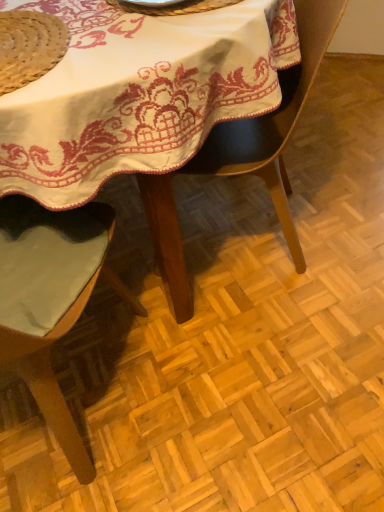
Question: Is green fabric chair at left, which is the second chair in right-to-left order, oriented away from black leather chair at center, the second chair in the left-to-right sequence?

Choices:
 (A) yes
 (B) no

Answer: (B)

Question: Is green fabric chair at left, which is the second chair in right-to-left order, at the right side of black leather chair at center, the first chair viewed from the right?

Choices:
 (A) yes
 (B) no

Answer: (B)

Question: Considering the relative sizes of green fabric chair at left, which appears as the 1th chair when viewed from the left, and black leather chair at center, the second chair in the left-to-right sequence, in the image provided, is green fabric chair at left, which appears as the 1th chair when viewed from the left, bigger than black leather chair at center, the second chair in the left-to-right sequence,?

Choices:
 (A) no
 (B) yes

Answer: (B)

Question: From a real-world perspective, is green fabric chair at left, which is the second chair in right-to-left order, positioned under black leather chair at center, the second chair in the left-to-right sequence, based on gravity?

Choices:
 (A) no
 (B) yes

Answer: (B)

Question: Is green fabric chair at left, which is the second chair in right-to-left order, wider than black leather chair at center, the second chair in the left-to-right sequence?

Choices:
 (A) no
 (B) yes

Answer: (B)

Question: Is natural straw hat at upper left inside the boundaries of green fabric chair at left, which is the second chair in right-to-left order, or outside?

Choices:
 (A) inside
 (B) outside

Answer: (A)

Question: Considering the positions of natural straw hat at upper left and green fabric chair at left, which is the second chair in right-to-left order, in the image, is natural straw hat at upper left wider or thinner than green fabric chair at left, which is the second chair in right-to-left order,?

Choices:
 (A) thin
 (B) wide

Answer: (A)

Question: In terms of size, does natural straw hat at upper left appear bigger or smaller than green fabric chair at left, which is the second chair in right-to-left order?

Choices:
 (A) big
 (B) small

Answer: (B)

Question: Considering the positions of point (49, 38) and point (43, 362), is point (49, 38) closer or farther from the camera than point (43, 362)?

Choices:
 (A) farther
 (B) closer

Answer: (B)

Question: Is point (8, 280) positioned closer to the camera than point (41, 68)?

Choices:
 (A) farther
 (B) closer

Answer: (A)

Question: Looking at their shapes, would you say green fabric chair at left, which appears as the 1th chair when viewed from the left, is wider or thinner than natural straw hat at upper left?

Choices:
 (A) wide
 (B) thin

Answer: (A)

Question: Choose the correct answer: Is green fabric chair at left, which appears as the 1th chair when viewed from the left, inside natural straw hat at upper left or outside it?

Choices:
 (A) outside
 (B) inside

Answer: (A)

Question: Visually, is green fabric chair at left, which appears as the 1th chair when viewed from the left, positioned to the left or to the right of natural straw hat at upper left?

Choices:
 (A) right
 (B) left

Answer: (B)

Question: Looking at the image, does metallic silver plate at upper center seem bigger or smaller compared to natural straw hat at upper left?

Choices:
 (A) big
 (B) small

Answer: (A)

Question: Relative to natural straw hat at upper left, is metallic silver plate at upper center in front or behind?

Choices:
 (A) front
 (B) behind

Answer: (B)